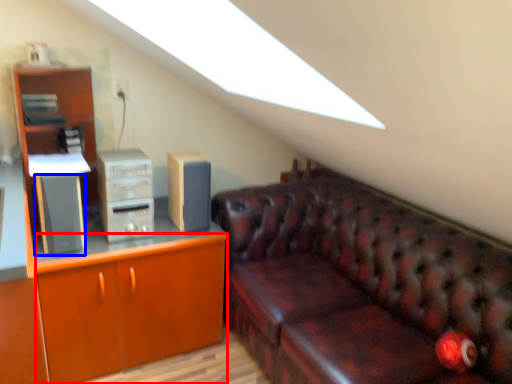
Question: Which point is closer to the camera, cabinetry (highlighted by a red box) or speaker (highlighted by a blue box)?

Choices:
 (A) cabinetry
 (B) speaker

Answer: (B)